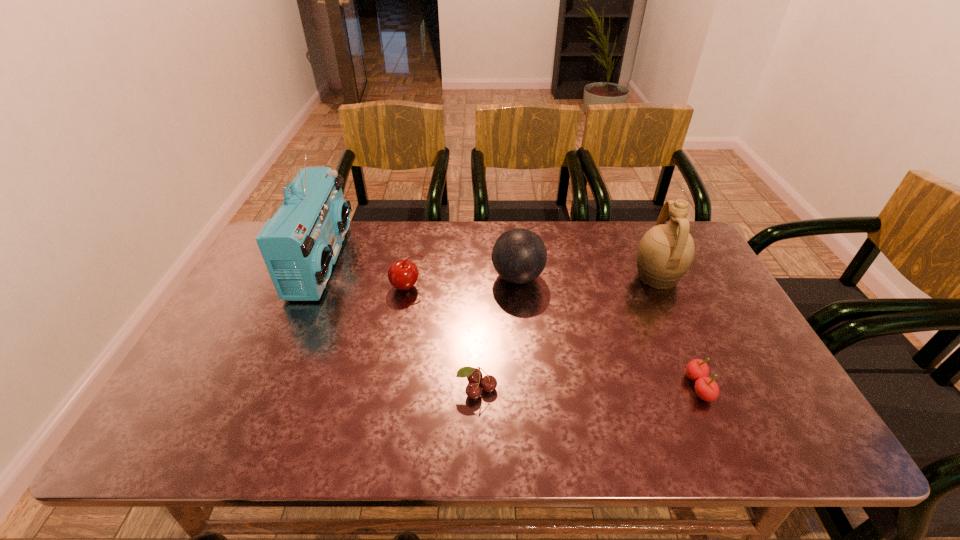
The image size is (960, 540). I want to click on vacant region located on the grip area of the third tallest object, so click(405, 277).

You are a GUI agent. You are given a task and a screenshot of the screen. Output one action in this format:
    pyautogui.click(x=<x>, y=<y>)
    Task: Click on the vacant space located on the grip area of the third tallest object
    The height and width of the screenshot is (540, 960).
    Given the screenshot: What is the action you would take?
    pyautogui.click(x=448, y=277)

I want to click on vacant space located 0.270m on the grip area of the third tallest object, so click(402, 277).

Locate an element on the screen. The height and width of the screenshot is (540, 960). vacant space located on the back of the fifth object from right to left is located at coordinates (414, 255).

At what (x,y) coordinates should I click in order to perform the action: click on vacant area situated on the right of the rightmost cherry. Please return your answer as a coordinate pair (x, y). Looking at the image, I should click on (753, 387).

You are a GUI agent. You are given a task and a screenshot of the screen. Output one action in this format:
    pyautogui.click(x=<x>, y=<y>)
    Task: Click on the vacant point located on the leaves of the second cherry from right to left
    
    Given the screenshot: What is the action you would take?
    [x=476, y=449]

In order to click on radio receiver that is at the far edge in this screenshot , I will do `click(300, 244)`.

Where is `pitcher that is at the far edge`? The height and width of the screenshot is (540, 960). pitcher that is at the far edge is located at coordinates (665, 253).

Locate an element on the screen. This screenshot has height=540, width=960. bowling ball that is at the far edge is located at coordinates (519, 256).

Identify the location of object positioned at the left edge. This screenshot has width=960, height=540. (300, 244).